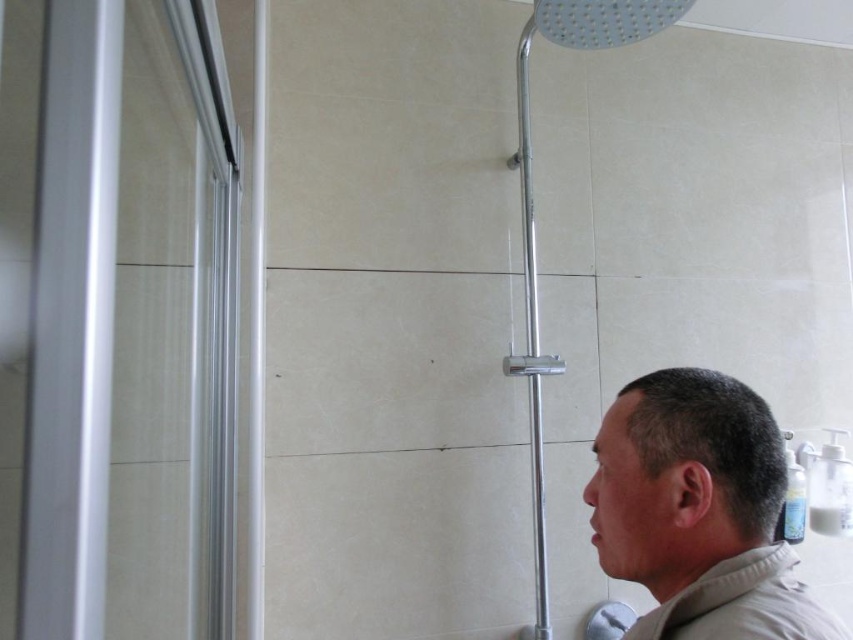
You are designing a bathroom layout and need to ensure that the gray matte head at lower right and the transparent glass shower door at left are positioned correctly. Based on their heights, which object should be placed lower to maintain visual balance?

The gray matte head at lower right should be placed lower since it is not as tall as the transparent glass shower door at left, helping to balance their heights in the design.

You are standing in the bathroom and want to reach both points labeled as point (x=657, y=467) and point (x=740, y=554). Which point should you target first to minimize the distance walked?

Point (x=657, y=467) is closer to you than point (x=740, y=554), so you should target point (x=657, y=467) first to minimize the distance walked.